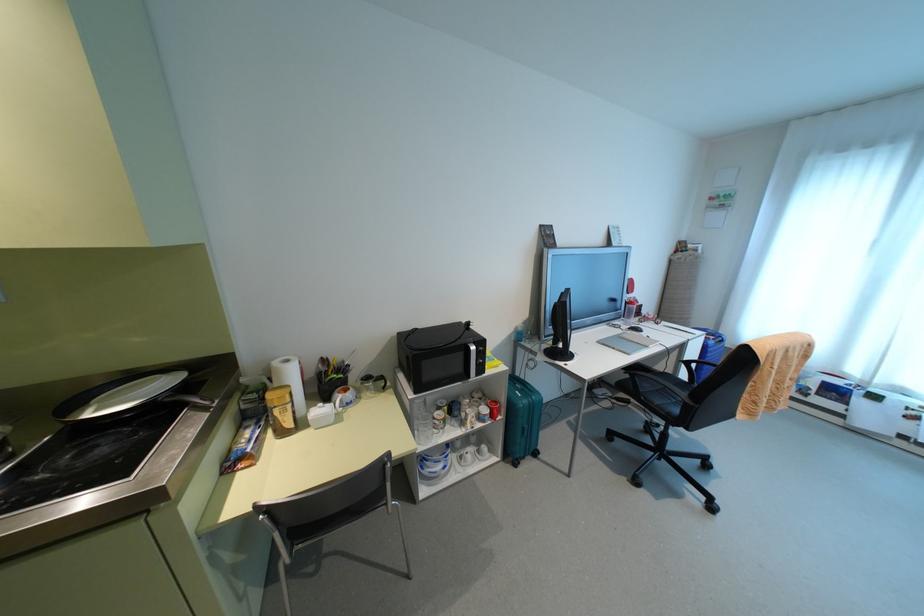
This screenshot has width=924, height=616. I want to click on frying pan handle, so click(187, 398).